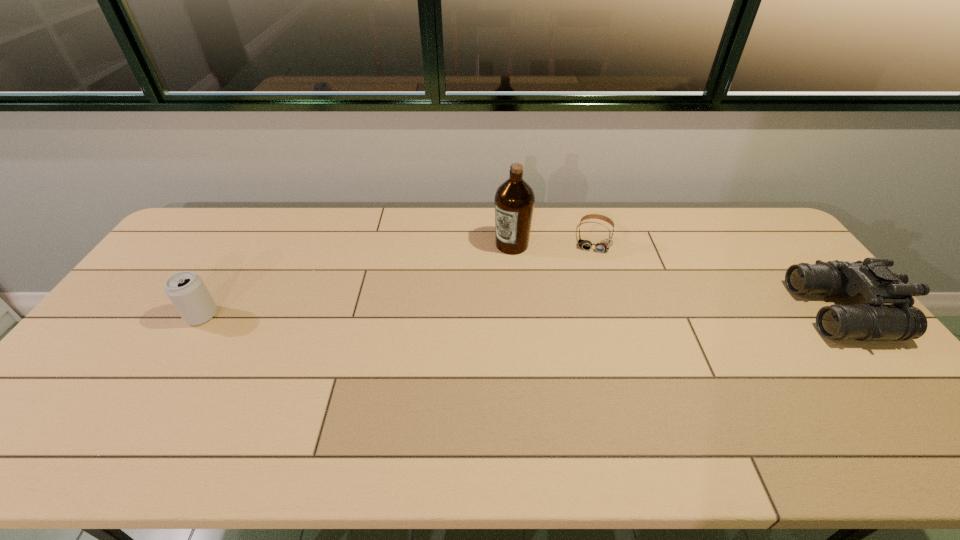
Find the location of a particular element. The image size is (960, 540). vacant area at the far left corner is located at coordinates (209, 231).

I want to click on free space at the far right corner of the desktop, so click(x=770, y=233).

Image resolution: width=960 pixels, height=540 pixels. What are the coordinates of `free space at the near right corner of the desktop` in the screenshot? It's located at (848, 392).

Find the location of `blank region between the third object from right to left and the binoculars`. blank region between the third object from right to left and the binoculars is located at coordinates (676, 278).

At what (x,y) coordinates should I click in order to perform the action: click on free space between the goggles and the can. Please return your answer as a coordinate pair (x, y). The height and width of the screenshot is (540, 960). Looking at the image, I should click on (398, 276).

Where is `vacant space that is in between the rightmost object and the second object from right to left`? The image size is (960, 540). vacant space that is in between the rightmost object and the second object from right to left is located at coordinates (717, 275).

This screenshot has height=540, width=960. Identify the location of vacant region between the tallest object and the third object from left to right. (553, 241).

The image size is (960, 540). In order to click on unoccupied position between the leftmost object and the third object from left to right in this screenshot , I will do `click(398, 276)`.

Find the location of a particular element. The image size is (960, 540). free space between the rightmost object and the leftmost object is located at coordinates (521, 314).

Identify the location of unoccupied position between the goggles and the rightmost object. The height and width of the screenshot is (540, 960). (717, 275).